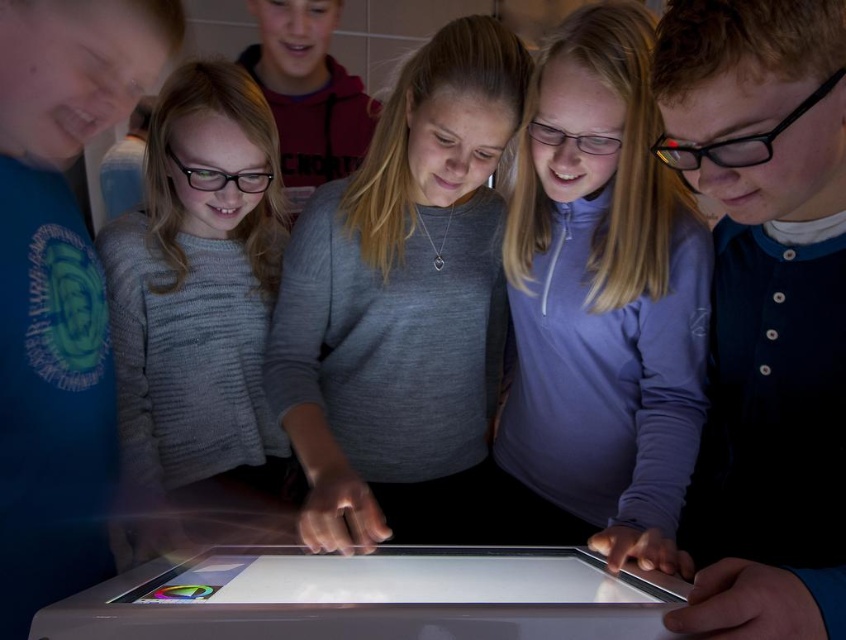
You are a photographer standing in front of the interactive display table. You notice the matte black glasses at center and the purple fleece jacket at center. Which object is closer to the camera?

The matte black glasses at center is shorter than the purple fleece jacket at center, so the purple fleece jacket at center is closer to the camera.

You are a teacher observing the children around the table. You need to retrieve the silver metallic tablet at center for a moment. Is the purple fleece jacket at center blocking your access to it?

The purple fleece jacket at center is positioned over the silver metallic tablet at center, so yes, the jacket is blocking access to the tablet.

You are a teacher observing the children around the interactive display table. You notice a specific point at coordinates [603,296] in the image. Which child is this point located on?

The point at coordinates [603,296] is located on the purple fleece jacket at center.